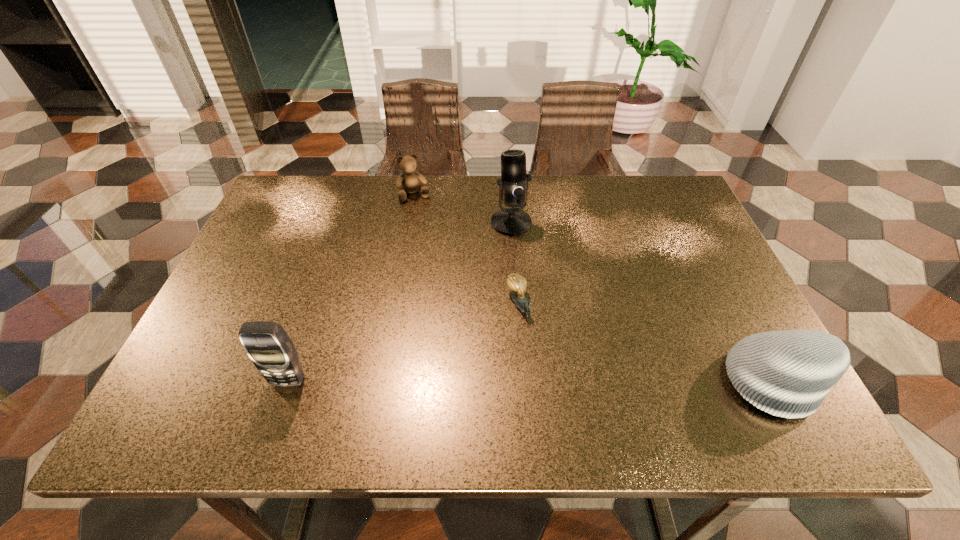
The height and width of the screenshot is (540, 960). In order to click on vacant spot on the desktop that is between the fourth shortest object and the beanie and is positioned on the stand of the second farthest object in this screenshot , I will do `click(535, 381)`.

The image size is (960, 540). In order to click on vacant space on the desktop that is between the fourth shortest object and the rightmost object and is positioned on the front-facing side of the second object from left to right in this screenshot , I will do `click(481, 381)`.

Image resolution: width=960 pixels, height=540 pixels. I want to click on free space on the desktop that is between the cellular telephone and the beanie and is positioned on the front-facing side of the escargot, so pyautogui.click(x=552, y=381).